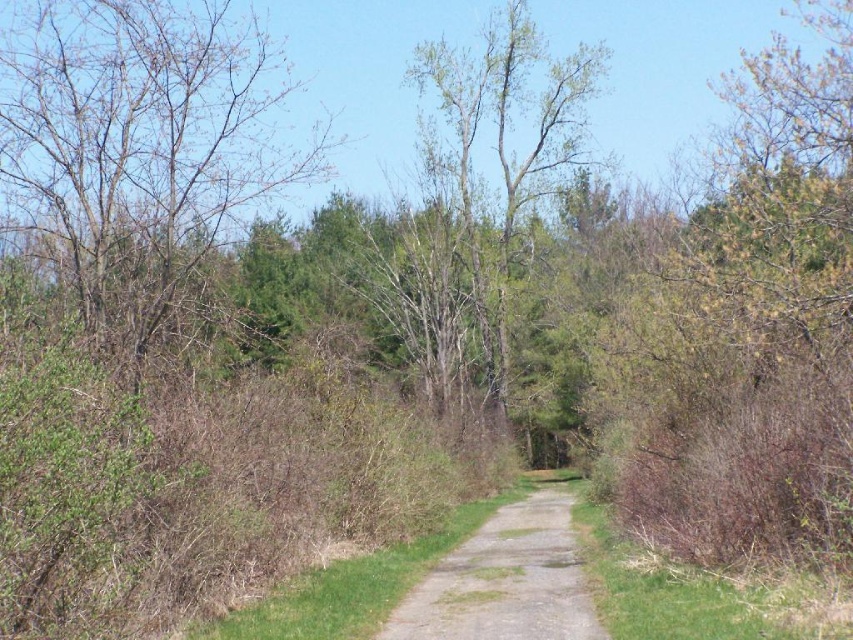
Is green leafy tree at center below dull gray gravel path at center?

Actually, green leafy tree at center is above dull gray gravel path at center.

Does green leafy tree at center appear over dull gray gravel path at center?

Yes.

Locate an element on the screen. The height and width of the screenshot is (640, 853). green leafy tree at center is located at coordinates (502, 154).

Is bare branches at left to the right of dull gray gravel path at center from the viewer's perspective?

Incorrect, bare branches at left is not on the right side of dull gray gravel path at center.

Who is higher up, bare branches at left or dull gray gravel path at center?

bare branches at left is above.

Which is in front, point (57, 184) or point (538, 563)?

Point (57, 184) is in front.

Locate an element on the screen. The image size is (853, 640). bare branches at left is located at coordinates (138, 145).

Where is `bare branches at left`? bare branches at left is located at coordinates (138, 145).

From the picture: Between bare branches at left and green leafy tree at center, which one appears on the left side from the viewer's perspective?

Positioned to the left is bare branches at left.

In order to click on bare branches at left in this screenshot , I will do `click(138, 145)`.